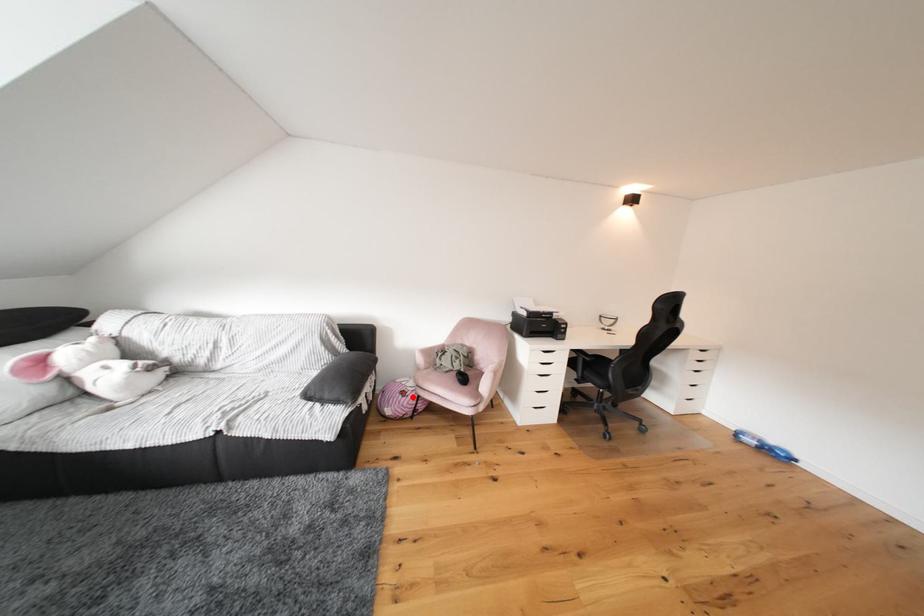
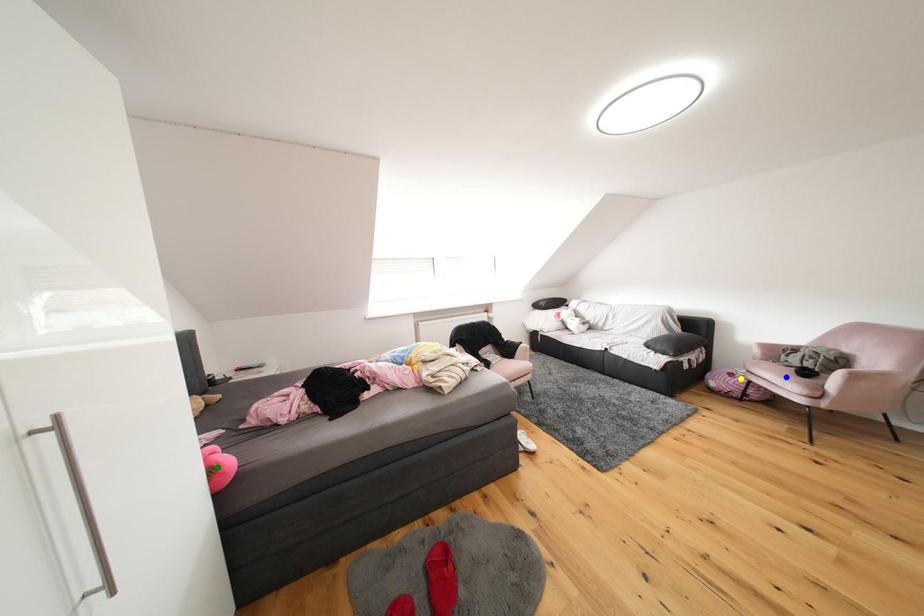
Question: I am providing you with two images of the same scene from different viewpoints. A red point is marked on the first image. You are given multiple points on the second image. Which point in image 2 is actually the same real-world point as the red point in image 1?

Choices:
 (A) blue point
 (B) yellow point
 (C) green point

Answer: (B)